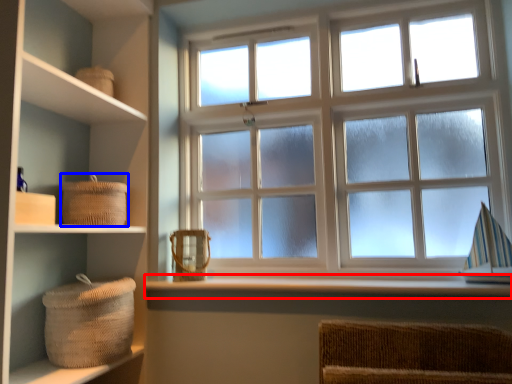
Question: Which of the following is the closest to the observer, window sill (highlighted by a red box) or basket (highlighted by a blue box)?

Choices:
 (A) window sill
 (B) basket

Answer: (A)